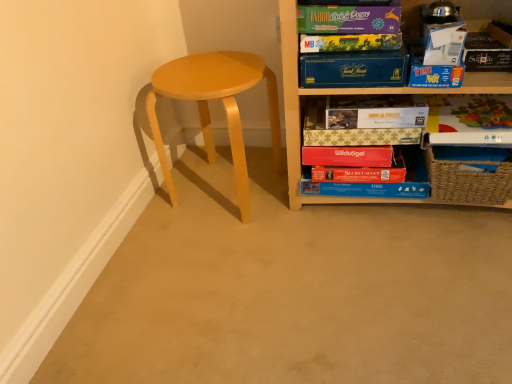
Question: Can you confirm if woven brown basket at lower right is bigger than matte cardboard book at upper center, which ranks as the 3th paperback book in bottom-to-top order?

Choices:
 (A) yes
 (B) no

Answer: (A)

Question: Considering the relative sizes of woven brown basket at lower right and matte cardboard book at upper center, which is counted as the 4th paperback book, starting from the top, in the image provided, is woven brown basket at lower right smaller than matte cardboard book at upper center, which is counted as the 4th paperback book, starting from the top,?

Choices:
 (A) yes
 (B) no

Answer: (B)

Question: Considering the relative positions of woven brown basket at lower right and matte cardboard book at upper center, which is counted as the 4th paperback book, starting from the top, in the image provided, is woven brown basket at lower right in front of matte cardboard book at upper center, which is counted as the 4th paperback book, starting from the top,?

Choices:
 (A) yes
 (B) no

Answer: (A)

Question: Does woven brown basket at lower right have a greater width compared to matte cardboard book at upper center, which ranks as the 3th paperback book in bottom-to-top order?

Choices:
 (A) no
 (B) yes

Answer: (B)

Question: From the image's perspective, is woven brown basket at lower right located beneath matte cardboard book at upper center, which is counted as the 4th paperback book, starting from the top?

Choices:
 (A) no
 (B) yes

Answer: (B)

Question: Considering the relative positions of matte yellow stool at left and matte cardboard book at upper center, which ranks as the 3th paperback book in bottom-to-top order, in the image provided, is matte yellow stool at left to the left or to the right of matte cardboard book at upper center, which ranks as the 3th paperback book in bottom-to-top order,?

Choices:
 (A) right
 (B) left

Answer: (B)

Question: Is matte yellow stool at left bigger or smaller than matte cardboard book at upper center, which is counted as the 4th paperback book, starting from the top?

Choices:
 (A) big
 (B) small

Answer: (A)

Question: Considering the positions of point (170, 62) and point (360, 115), is point (170, 62) closer or farther from the camera than point (360, 115)?

Choices:
 (A) farther
 (B) closer

Answer: (A)

Question: Is matte yellow stool at left wider or thinner than matte cardboard book at upper center, which ranks as the 3th paperback book in bottom-to-top order?

Choices:
 (A) wide
 (B) thin

Answer: (A)

Question: From a real-world perspective, is matte purple board game at upper right, the sixth paperback book in the bottom-to-top sequence, positioned above or below blue cardboard puzzle at lower center?

Choices:
 (A) above
 (B) below

Answer: (A)

Question: From the image's perspective, is matte purple board game at upper right, the sixth paperback book in the bottom-to-top sequence, above or below blue cardboard puzzle at lower center?

Choices:
 (A) below
 (B) above

Answer: (B)

Question: Is point (314, 18) closer or farther from the camera than point (419, 168)?

Choices:
 (A) closer
 (B) farther

Answer: (A)

Question: Is matte purple board game at upper right, placed as the 1th paperback book when sorted from top to bottom, bigger or smaller than blue cardboard puzzle at lower center?

Choices:
 (A) small
 (B) big

Answer: (A)

Question: Is point (417, 195) closer or farther from the camera than point (325, 34)?

Choices:
 (A) farther
 (B) closer

Answer: (A)

Question: In terms of width, does blue cardboard puzzle at lower center look wider or thinner when compared to matte cardboard game at upper right, which is the fifth paperback book from bottom to top?

Choices:
 (A) thin
 (B) wide

Answer: (B)